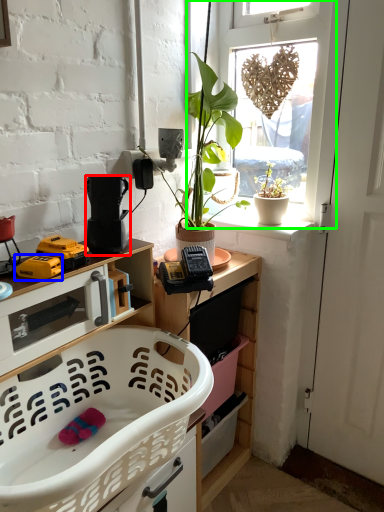
Question: Considering the real-world distances, which object is closest to appliance (highlighted by a red box)? toy (highlighted by a blue box) or window (highlighted by a green box).

Choices:
 (A) toy
 (B) window

Answer: (A)